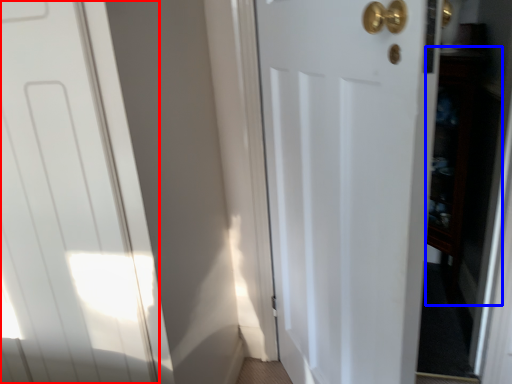
Question: Which object appears farthest to the camera in this image, door (highlighted by a red box) or cabinetry (highlighted by a blue box)?

Choices:
 (A) door
 (B) cabinetry

Answer: (B)